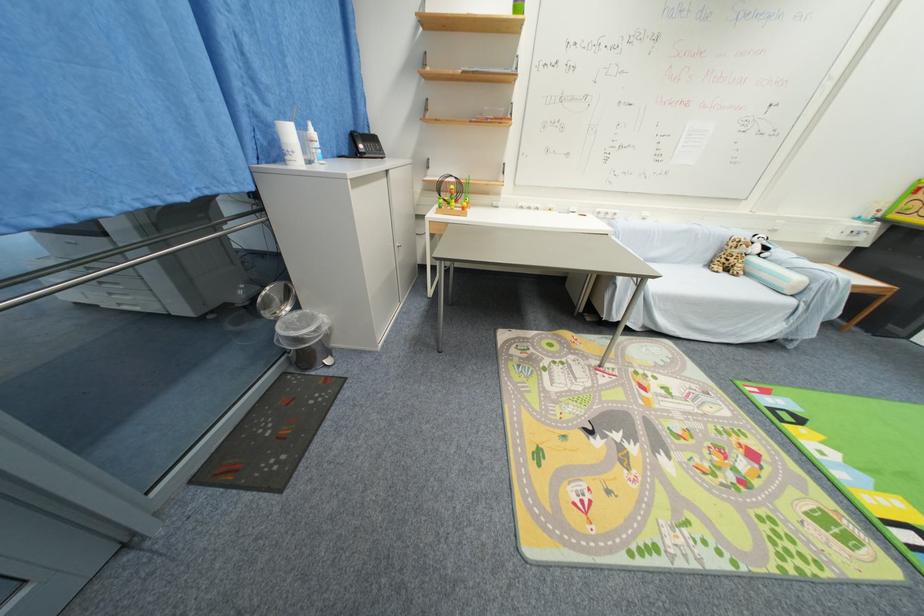
Identify the location of sofa sitting surface. Image resolution: width=924 pixels, height=616 pixels. 718,290.